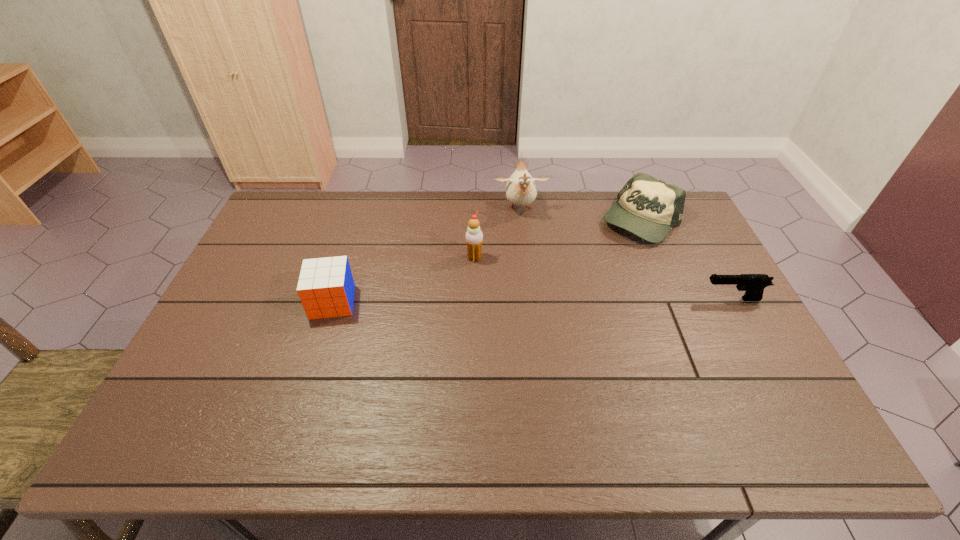
I want to click on bird located in the far edge section of the desktop, so click(x=521, y=190).

The height and width of the screenshot is (540, 960). Identify the location of pistol situated at the right edge. (753, 284).

At what (x,y) coordinates should I click in order to perform the action: click on baseball cap situated at the right edge. Please return your answer as a coordinate pair (x, y). This screenshot has height=540, width=960. Looking at the image, I should click on tap(647, 207).

The height and width of the screenshot is (540, 960). What are the coordinates of `object present at the far right corner` in the screenshot? It's located at (647, 207).

Find the location of a particular element. vacant space at the far edge of the desktop is located at coordinates [x=503, y=228].

Find the location of a particular element. Image resolution: width=960 pixels, height=540 pixels. vacant space at the near edge of the desktop is located at coordinates (564, 407).

At what (x,y) coordinates should I click in order to perform the action: click on vacant position at the left edge of the desktop. Please return your answer as a coordinate pair (x, y). The image size is (960, 540). Looking at the image, I should click on (269, 268).

Image resolution: width=960 pixels, height=540 pixels. I want to click on vacant space at the right edge of the desktop, so click(716, 373).

Identify the location of vacant space at the far left corner. The height and width of the screenshot is (540, 960). (290, 202).

Find the location of `vacant point located between the pistol and the leftmost object`. vacant point located between the pistol and the leftmost object is located at coordinates (532, 301).